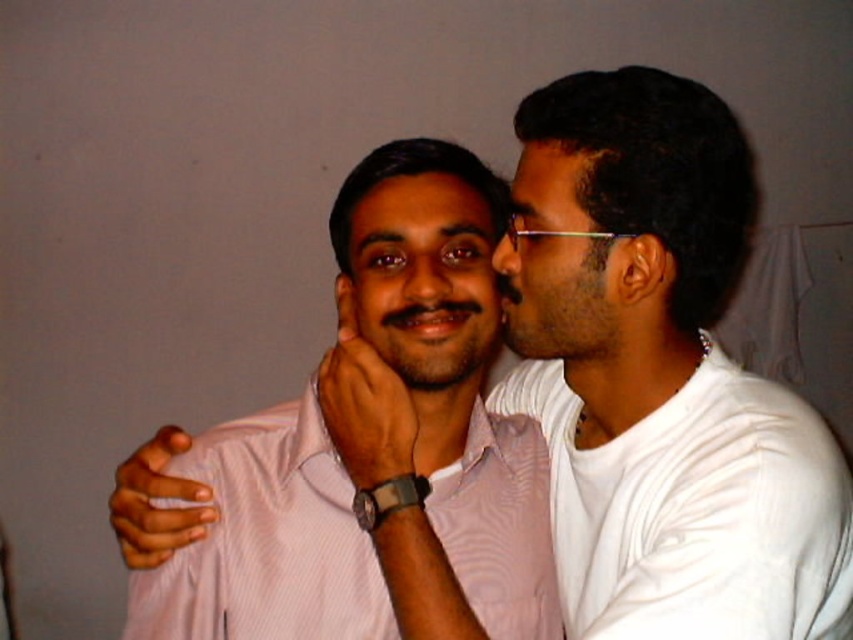
Can you confirm if matte pink shirt at center is taller than matte black face at upper right?

Yes, matte pink shirt at center is taller than matte black face at upper right.

Where is `matte pink shirt at center`? matte pink shirt at center is located at coordinates (424, 278).

Locate an element on the screen. The width and height of the screenshot is (853, 640). matte pink shirt at center is located at coordinates (424, 278).

Can you confirm if white cotton dress shirt at right is smaller than pink striped dress shirt at center?

No.

Is the position of white cotton dress shirt at right more distant than that of pink striped dress shirt at center?

No.

Is point (643, 628) positioned after point (329, 544)?

No, (643, 628) is closer to viewer.

The image size is (853, 640). Identify the location of white cotton dress shirt at right. (695, 512).

Is point (749, 452) closer to viewer compared to point (426, 221)?

Yes, point (749, 452) is closer to viewer.

Does white cotton dress shirt at right come in front of matte pink shirt at center?

Yes, it is in front of matte pink shirt at center.

What do you see at coordinates (695, 512) in the screenshot?
I see `white cotton dress shirt at right` at bounding box center [695, 512].

At what (x,y) coordinates should I click in order to perform the action: click on white cotton dress shirt at right. Please return your answer as a coordinate pair (x, y). This screenshot has height=640, width=853. Looking at the image, I should click on (695, 512).